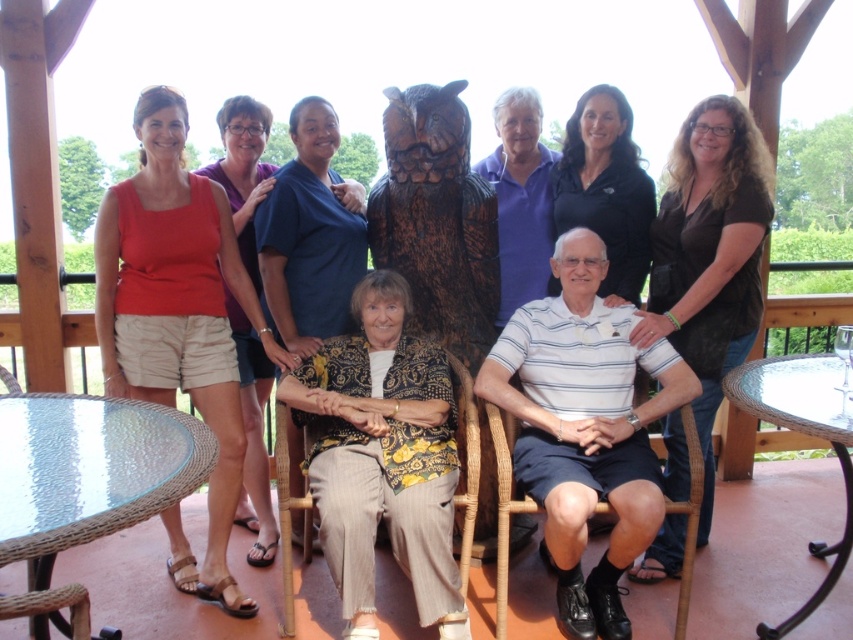
Question: Observing the image, what is the correct spatial positioning of black shirt at center in reference to black matte shirt at upper center?

Choices:
 (A) below
 (B) above

Answer: (A)

Question: Among these objects, which one is nearest to the camera?

Choices:
 (A) clear glass table at lower right
 (B) woven wood chair at center
 (C) matte blue shirt at center

Answer: (A)

Question: Is matte orange tank top at left wider than woven wood chair at center?

Choices:
 (A) no
 (B) yes

Answer: (B)

Question: From the image, what is the correct spatial relationship of clear glass table at lower left in relation to brown wicker chair at lower center?

Choices:
 (A) above
 (B) below

Answer: (A)

Question: Considering the real-world distances, which object is closest to the woven wood chair at center?

Choices:
 (A) matte orange tank top at left
 (B) black shirt at center
 (C) brown wicker chair at lower center

Answer: (C)

Question: Which point is farther to the camera?

Choices:
 (A) black shirt at center
 (B) clear glass table at lower right
 (C) matte black owl at center

Answer: (A)